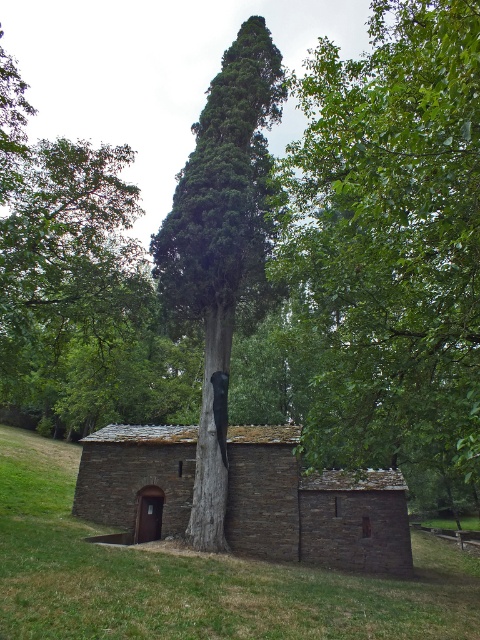
Is stone hut at center below green textured tree at center?

Indeed, stone hut at center is positioned under green textured tree at center.

Who is more forward, (360, 525) or (268, 36)?

Positioned in front is point (360, 525).

Find the location of a particular element. This screenshot has width=480, height=640. stone hut at center is located at coordinates (312, 508).

The width and height of the screenshot is (480, 640). Find the location of `stone hut at center`. stone hut at center is located at coordinates (312, 508).

Does green leafy tree at center appear on the right side of green rough bark tree trunk at center?

Indeed, green leafy tree at center is positioned on the right side of green rough bark tree trunk at center.

What do you see at coordinates (392, 244) in the screenshot? I see `green leafy tree at center` at bounding box center [392, 244].

What do you see at coordinates (392, 244) in the screenshot? I see `green leafy tree at center` at bounding box center [392, 244].

Locate an element on the screen. Image resolution: width=480 pixels, height=640 pixels. green leafy tree at center is located at coordinates (392, 244).

Is green leafy tree at center smaller than green textured tree at center?

Incorrect, green leafy tree at center is not smaller in size than green textured tree at center.

Can you confirm if green leafy tree at center is positioned to the right of green textured tree at center?

Correct, you'll find green leafy tree at center to the right of green textured tree at center.

This screenshot has width=480, height=640. Find the location of `green leafy tree at center`. green leafy tree at center is located at coordinates (392, 244).

Where is `green leafy tree at center`? Image resolution: width=480 pixels, height=640 pixels. green leafy tree at center is located at coordinates (392, 244).